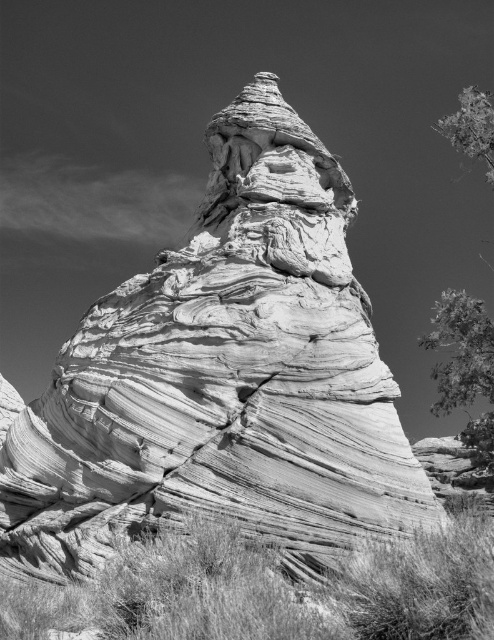
Question: Does green leafy tree at upper right have a larger size compared to smooth green leaves at upper right?

Choices:
 (A) yes
 (B) no

Answer: (A)

Question: Is the position of green leafy tree at upper right less distant than that of smooth green leaves at upper right?

Choices:
 (A) yes
 (B) no

Answer: (A)

Question: Is green leafy tree at upper right above smooth green leaves at upper right?

Choices:
 (A) yes
 (B) no

Answer: (B)

Question: Which point appears farthest from the camera in this image?

Choices:
 (A) coord(476,128)
 (B) coord(459,108)

Answer: (B)

Question: Which point is closer to the camera?

Choices:
 (A) pyautogui.click(x=475, y=384)
 (B) pyautogui.click(x=491, y=172)

Answer: (A)